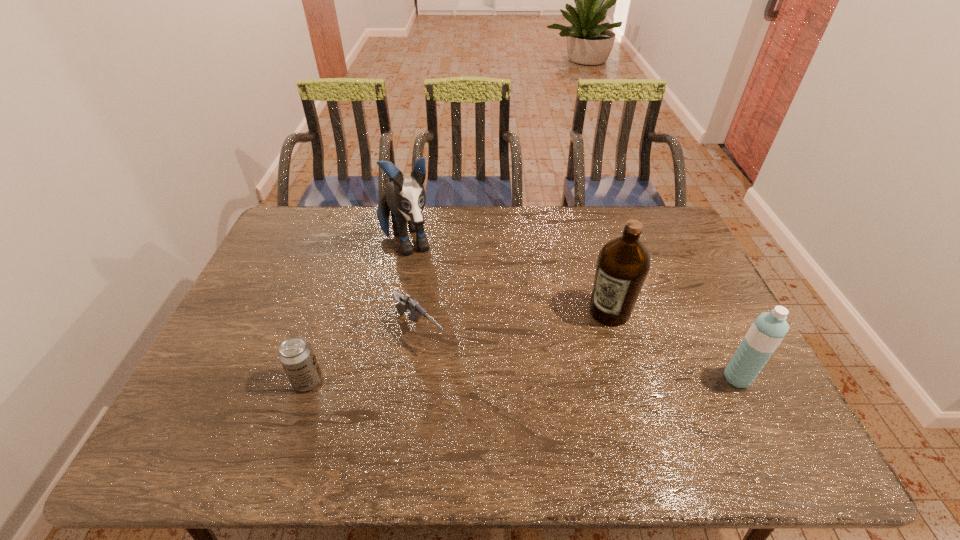
You are a GUI agent. You are given a task and a screenshot of the screen. Output one action in this format:
    pyautogui.click(x=<x>, y=<y>)
    Task: Click on the object present at the far edge
    
    Given the screenshot: What is the action you would take?
    pyautogui.click(x=406, y=199)

Where is `beer can located in the near edge section of the desktop`? This screenshot has height=540, width=960. beer can located in the near edge section of the desktop is located at coordinates (296, 355).

This screenshot has height=540, width=960. What are the coordinates of `water bottle located in the near edge section of the desktop` in the screenshot? It's located at (768, 330).

I want to click on object that is positioned at the right edge, so click(768, 330).

This screenshot has width=960, height=540. Identify the location of object present at the near right corner. (768, 330).

Locate an element on the screen. The width and height of the screenshot is (960, 540). free space at the far edge is located at coordinates (554, 223).

This screenshot has width=960, height=540. In order to click on vacant point at the near edge in this screenshot , I will do `click(541, 406)`.

You are a GUI agent. You are given a task and a screenshot of the screen. Output one action in this format:
    pyautogui.click(x=<x>, y=<y>)
    Task: Click on the vacant space at the left edge of the desktop
    The height and width of the screenshot is (540, 960).
    Given the screenshot: What is the action you would take?
    [274, 329]

Identify the location of free space at the far right corner. This screenshot has width=960, height=540. coord(668,241).

Image resolution: width=960 pixels, height=540 pixels. What are the coordinates of `free spot between the fourth tallest object and the fourth shortest object` in the screenshot? It's located at (459, 346).